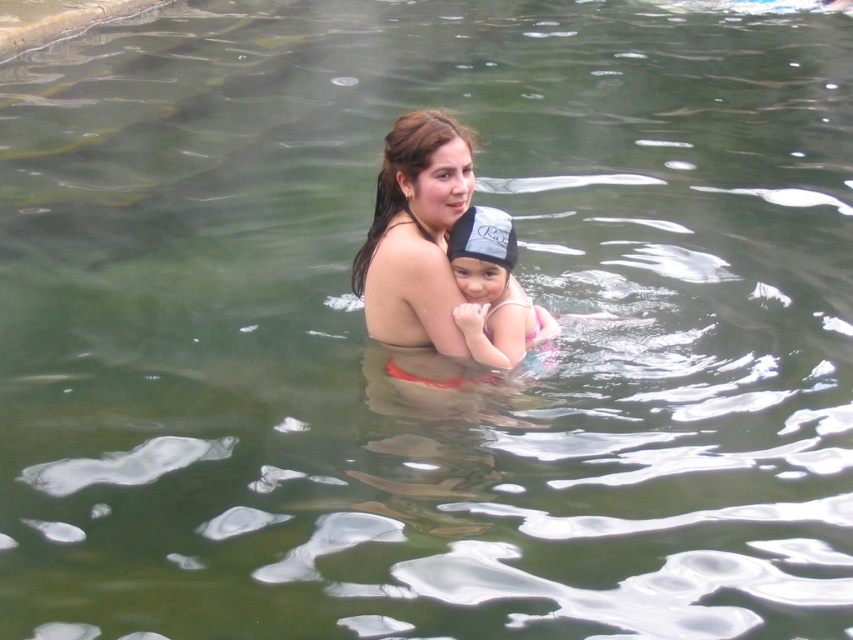
Question: Which object appears farthest from the camera in this image?

Choices:
 (A) pink fabric swimsuit at center
 (B) dark brown hair at center

Answer: (A)

Question: Is dark brown hair at center to the left of pink fabric swimsuit at center from the viewer's perspective?

Choices:
 (A) yes
 (B) no

Answer: (A)

Question: Can you confirm if dark brown hair at center is wider than pink fabric swimsuit at center?

Choices:
 (A) yes
 (B) no

Answer: (A)

Question: Which point appears farthest from the camera in this image?

Choices:
 (A) (386, 282)
 (B) (543, 324)

Answer: (B)

Question: Among these points, which one is farthest from the camera?

Choices:
 (A) tap(451, 248)
 (B) tap(440, 122)

Answer: (A)

Question: Is dark brown hair at center further to the viewer compared to pink fabric swimsuit at center?

Choices:
 (A) no
 (B) yes

Answer: (A)